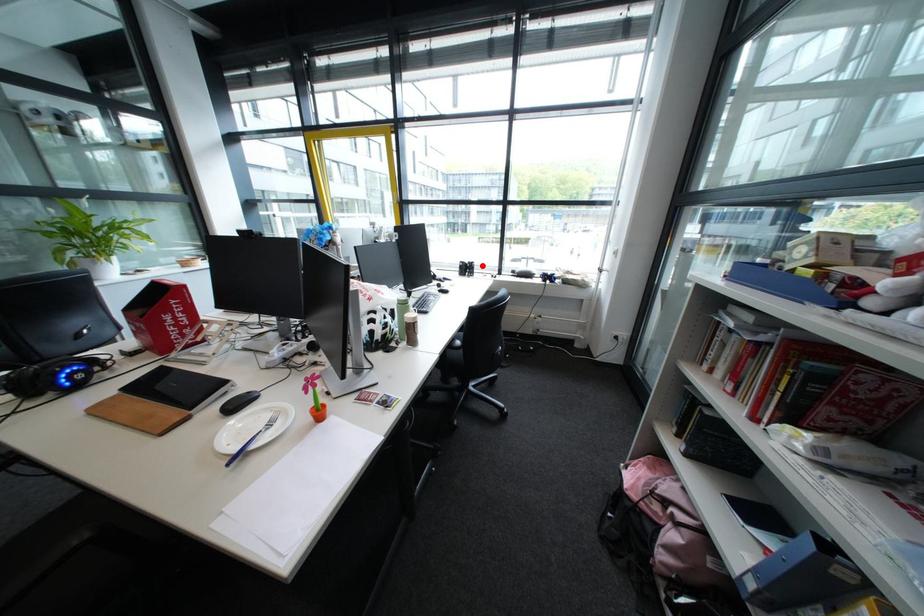
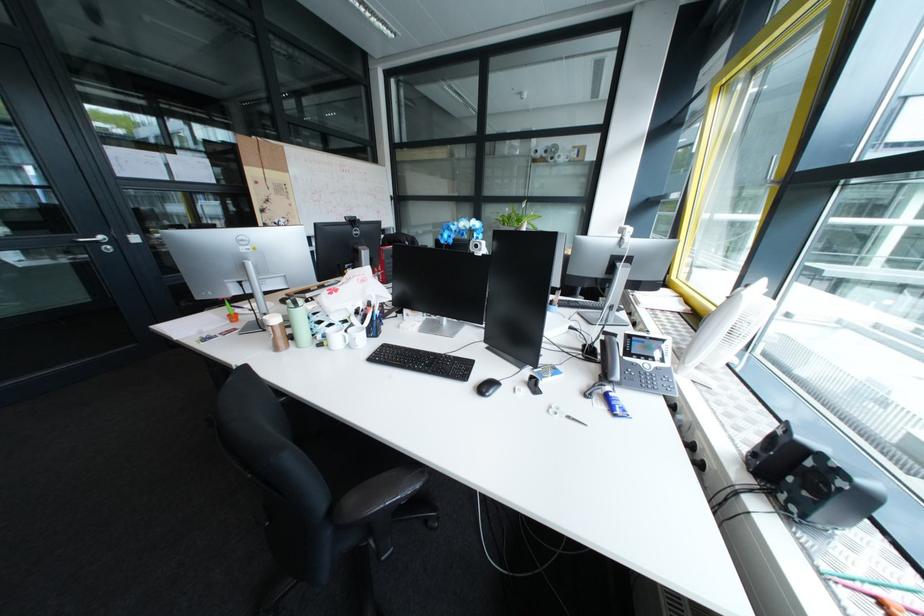
Question: A red point is marked in image1. In image2, is the corresponding 3D point closer to the camera or farther? Reply with the corresponding letter.

Choices:
 (A) The corresponding 3D point is closer.
 (B) The corresponding 3D point is farther.

Answer: (B)